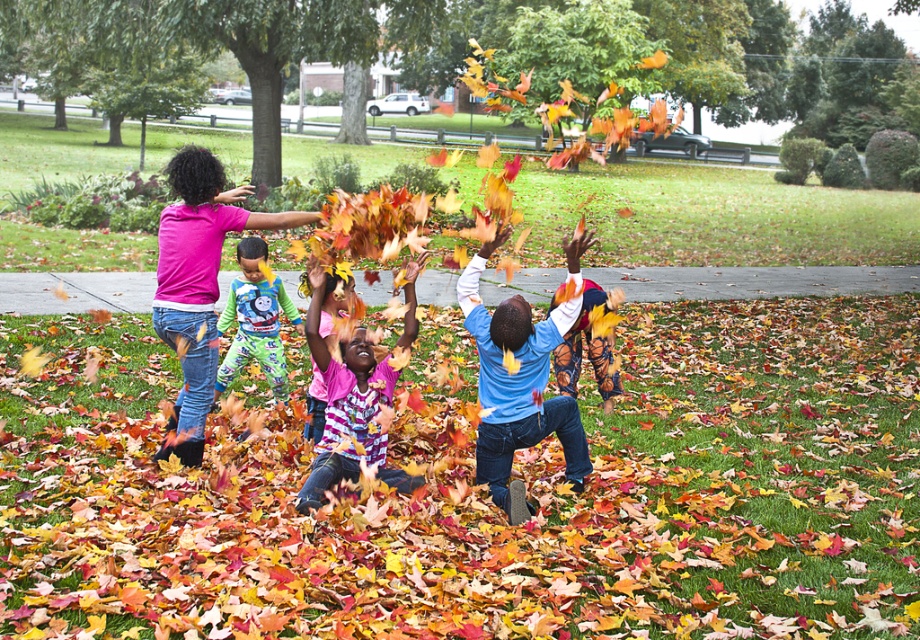
Question: In this image, where is blue fleece sweatshirt at center located relative to matte pink shirt at upper left?

Choices:
 (A) below
 (B) above

Answer: (A)

Question: Does matte pink shirt at upper left have a larger size compared to thomas the tank engine pajamas at center?

Choices:
 (A) yes
 (B) no

Answer: (A)

Question: Among these objects, which one is farthest from the camera?

Choices:
 (A) thomas the tank engine pajamas at center
 (B) matte pink shirt at center
 (C) blue fleece sweatshirt at center

Answer: (A)

Question: Which point appears closest to the camera in this image?

Choices:
 (A) pos(192,312)
 (B) pos(386,474)
 (C) pos(524,422)

Answer: (C)

Question: Does blue fleece sweatshirt at center appear on the right side of matte pink shirt at center?

Choices:
 (A) yes
 (B) no

Answer: (A)

Question: Which of the following is the closest to the observer?

Choices:
 (A) thomas the tank engine pajamas at center
 (B) blue fleece sweatshirt at center
 (C) matte pink shirt at upper left
 (D) matte pink shirt at center

Answer: (D)